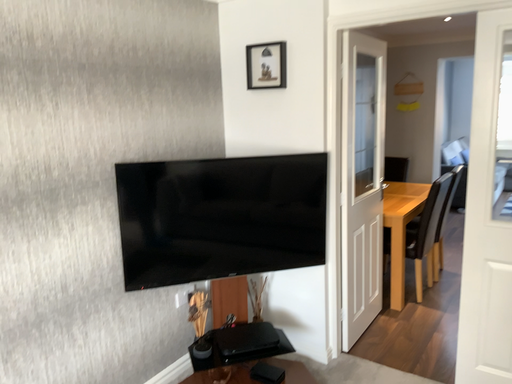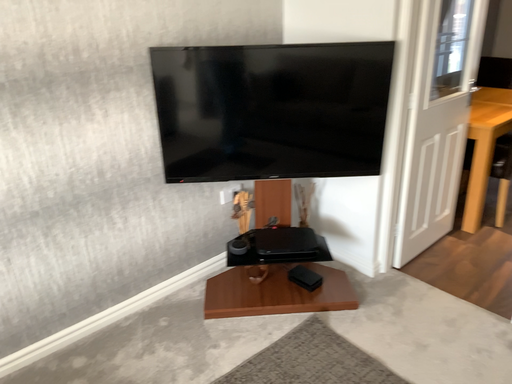
Question: How did the camera likely rotate when shooting the video?

Choices:
 (A) rotated left
 (B) rotated right

Answer: (A)